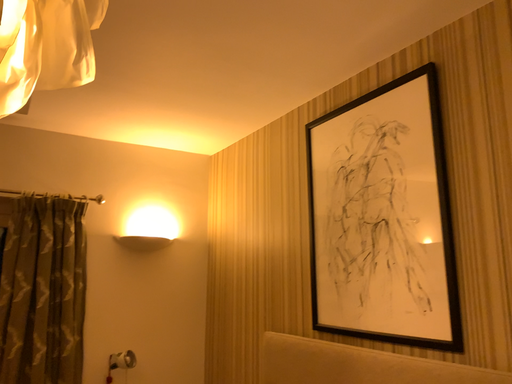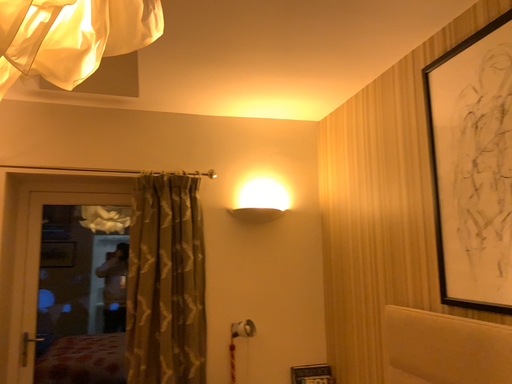
Question: How did the camera likely rotate when shooting the video?

Choices:
 (A) rotated right
 (B) rotated left

Answer: (B)